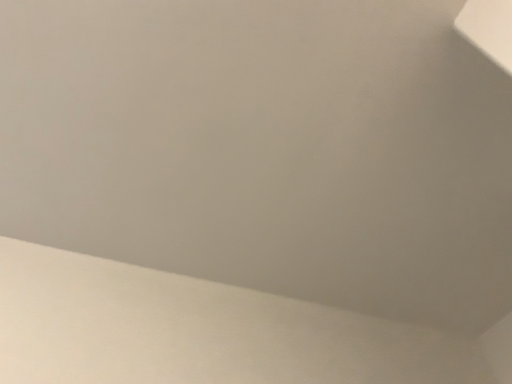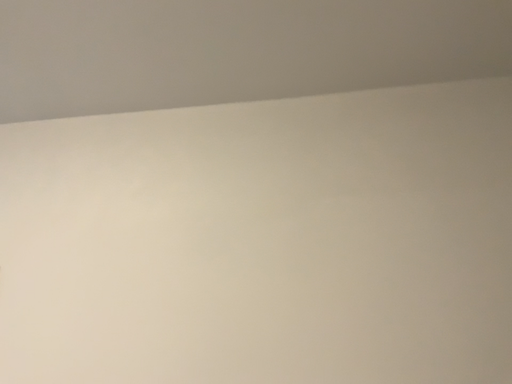
Question: Which way did the camera rotate in the video?

Choices:
 (A) rotated left
 (B) rotated right

Answer: (A)